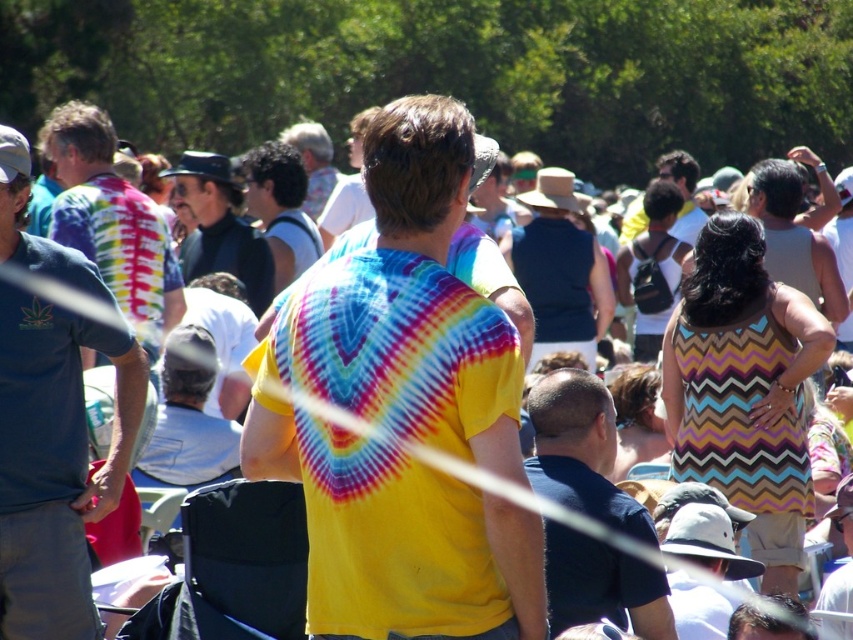
Question: Which object is positioned closest to the matte black hat at center?

Choices:
 (A) tie-dye fabric shirt at center
 (B) dark blue shirt at center
 (C) tie-dye fabric shirt at left
 (D) matte tie-dye shirt at left

Answer: (C)

Question: Which is farther from the striped tank top at center?

Choices:
 (A) matte tie-dye shirt at left
 (B) matte black hat at center
 (C) tie-dye fabric shirt at left

Answer: (A)

Question: Is matte tie-dye shirt at left to the right of black tank top at center from the viewer's perspective?

Choices:
 (A) yes
 (B) no

Answer: (B)

Question: Which point is farther to the camera?

Choices:
 (A) black tank top at center
 (B) tie-dye fabric shirt at center
 (C) tie-dye fabric shirt at left

Answer: (A)

Question: Where is tie-dye fabric shirt at left located in relation to striped tank top at center in the image?

Choices:
 (A) left
 (B) right

Answer: (A)

Question: Can you confirm if matte tie-dye shirt at left is bigger than matte black hat at center?

Choices:
 (A) yes
 (B) no

Answer: (A)